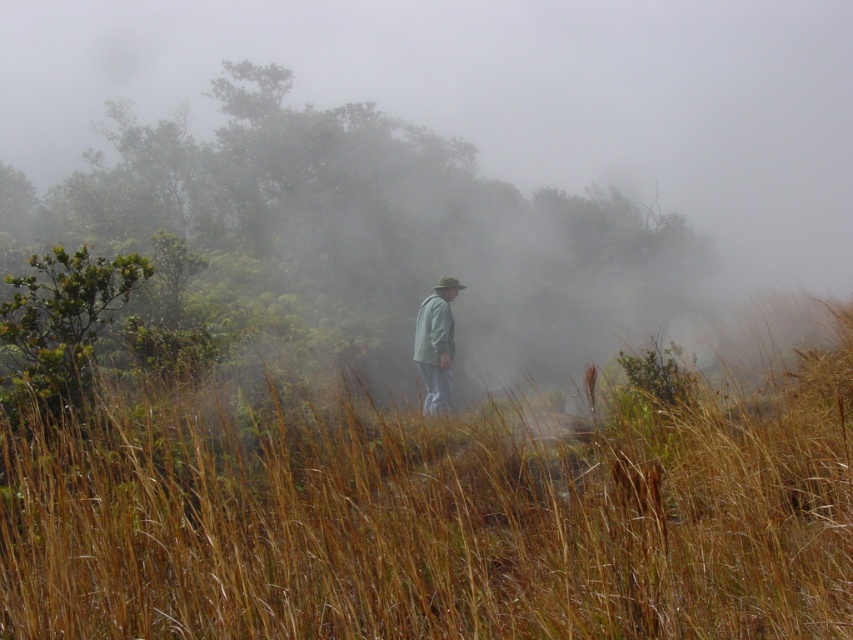
You are a hiker trying to cross through the brown dry grass at center and the light gray fabric jacket at center. Which object will you encounter first as you move forward?

The light gray fabric jacket at center will be encountered first because the brown dry grass at center is larger in size, implying it might be further back or occupy more space, making the jacket closer to the observer.

You are a hiker who has just reached the peak of a mountain. You notice the brown dry grass at center and the light gray fabric jacket at center. Which object is closer to the ground?

The brown dry grass at center is positioned under the light gray fabric jacket at center, so the brown dry grass at center is closer to the ground.